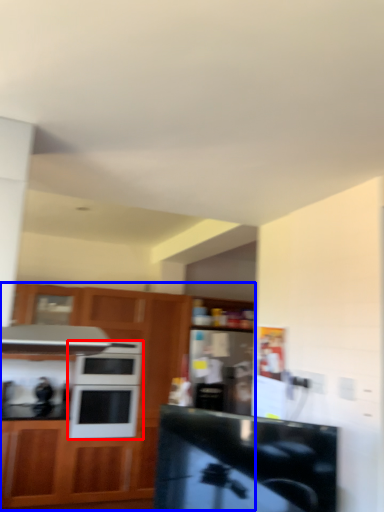
Question: Which of the following is the closest to the observer, microwave oven (highlighted by a red box) or cabinetry (highlighted by a blue box)?

Choices:
 (A) microwave oven
 (B) cabinetry

Answer: (B)